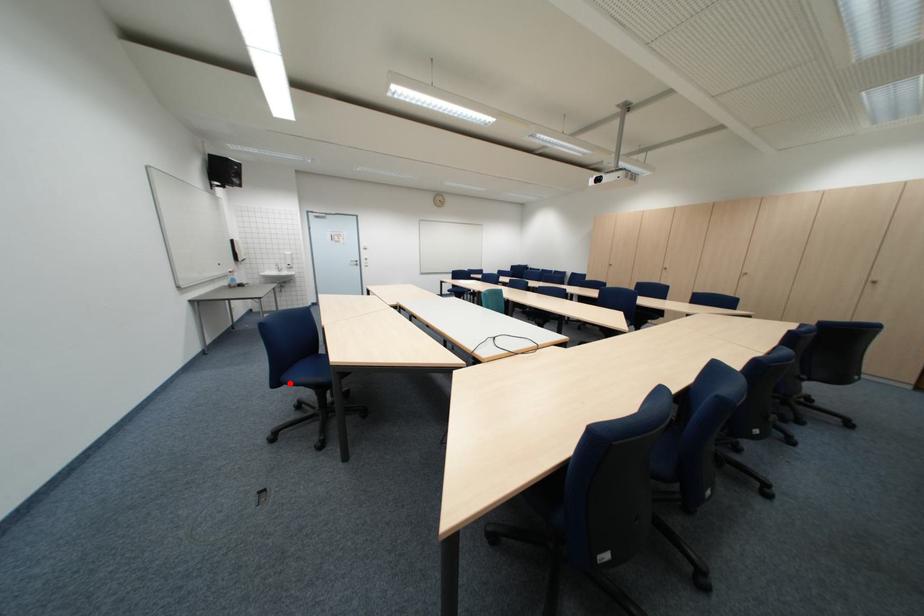
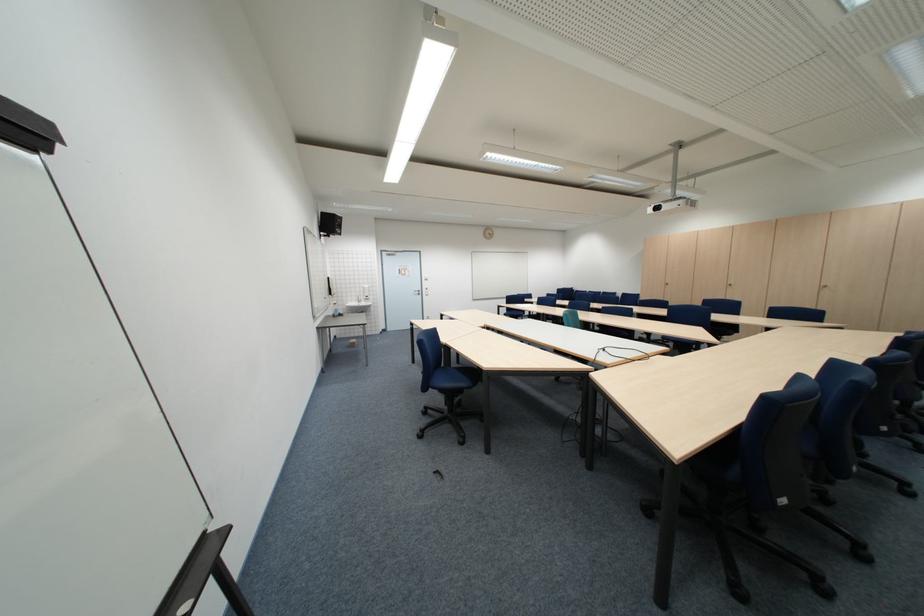
In the second image, find the point that corresponds to the highlighted location in the first image.

(439, 389)